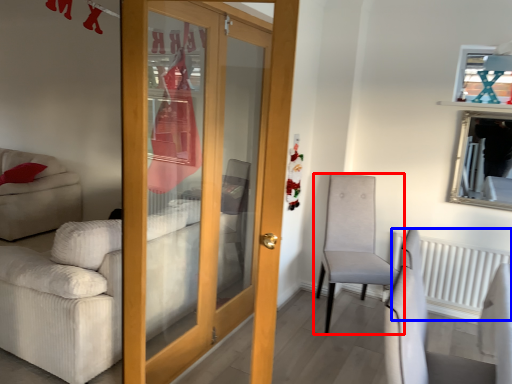
Question: Which object is closer to the camera taking this photo, chair (highlighted by a red box) or radiator (highlighted by a blue box)?

Choices:
 (A) chair
 (B) radiator

Answer: (A)